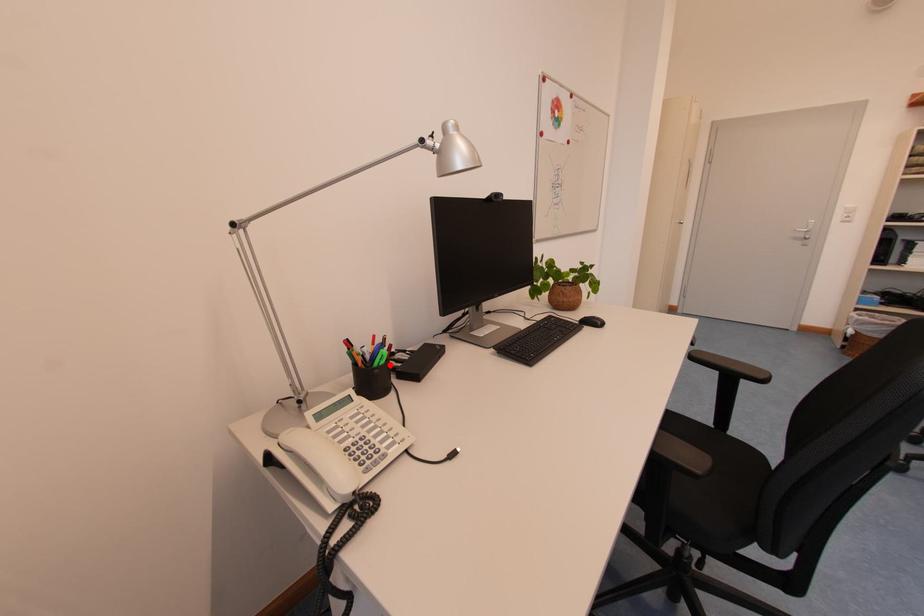
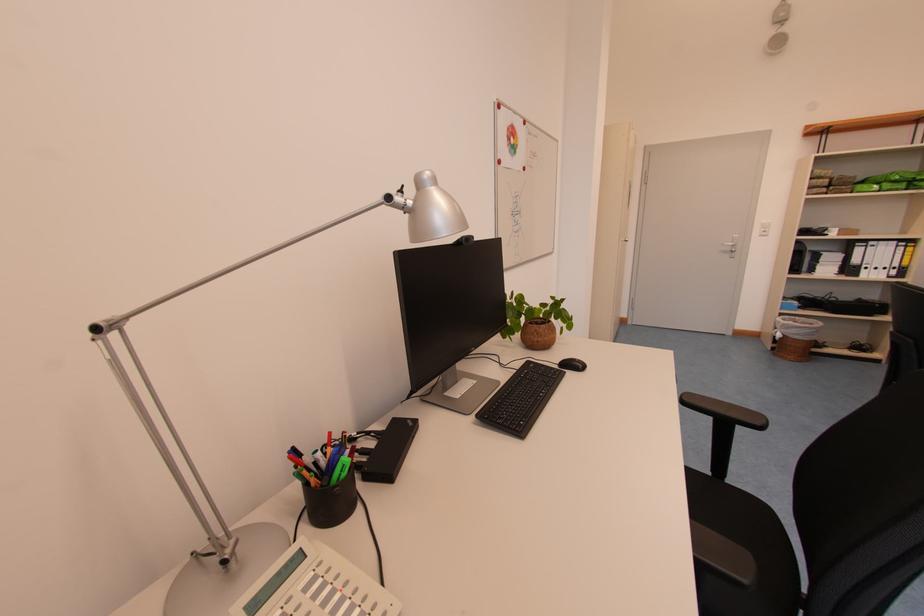
In the second image, find the point that corresponds to the highlighted location in the first image.

(351, 477)